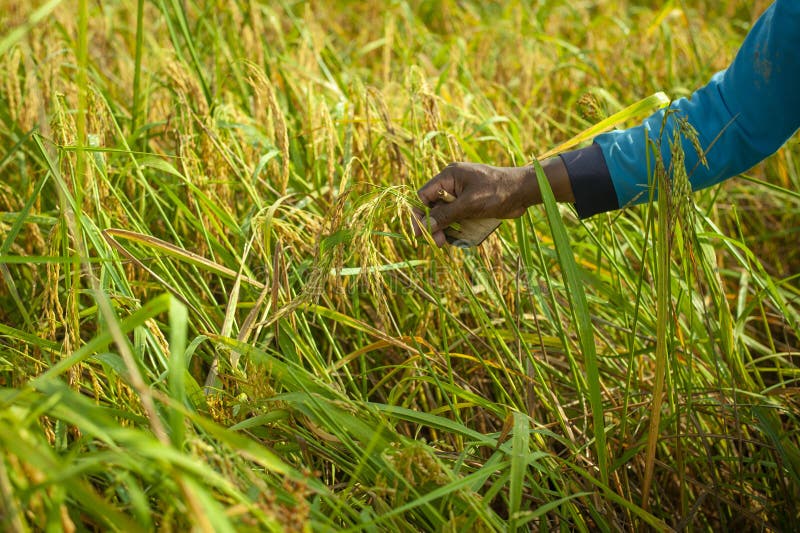
This screenshot has height=533, width=800. In order to click on dead plant in this screenshot , I will do `click(229, 309)`, `click(248, 320)`.